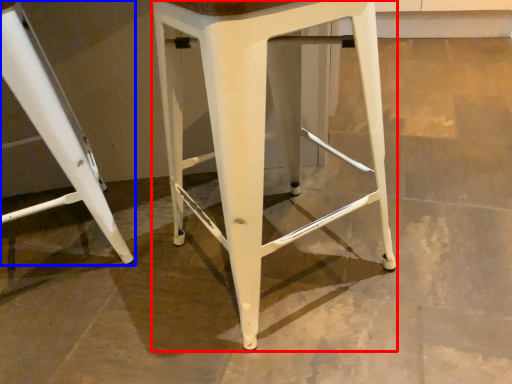
Question: Among these objects, which one is nearest to the camera, stool (highlighted by a red box) or stool (highlighted by a blue box)?

Choices:
 (A) stool
 (B) stool

Answer: (A)